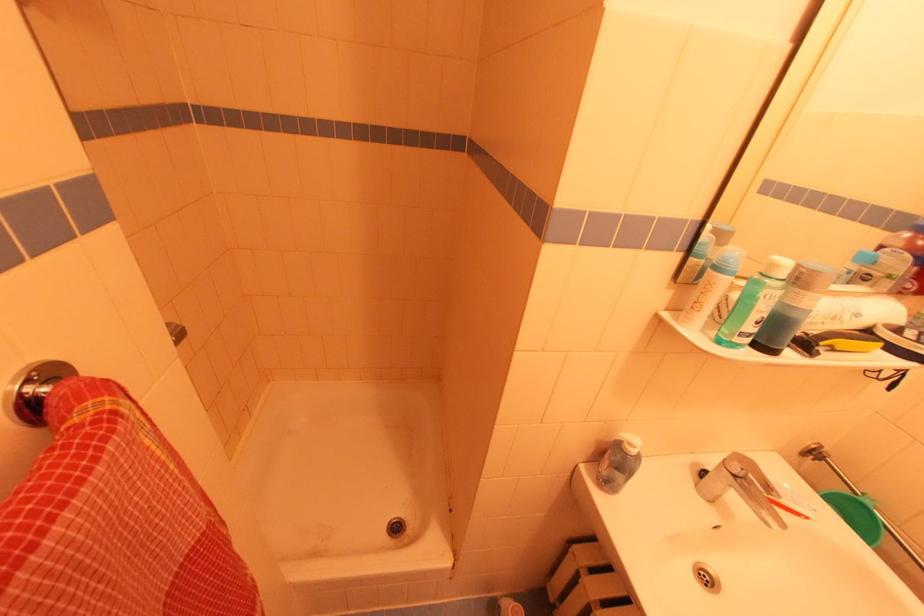
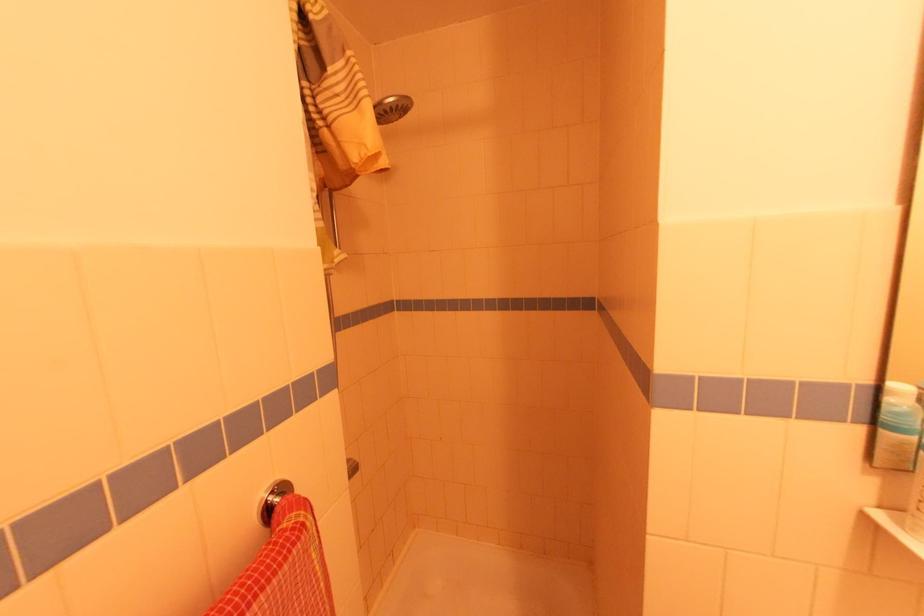
Locate, in the second image, the point that corresponds to the point at 699,265 in the first image.

(906, 445)